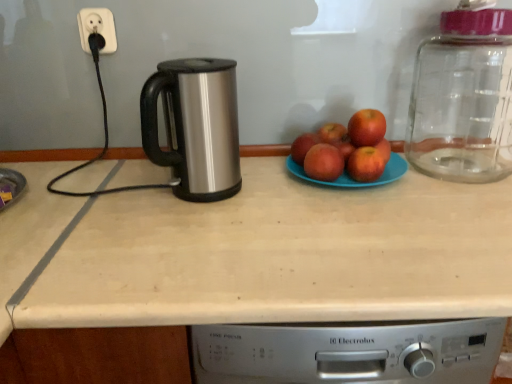
Based on the photo, measure the distance between point [110,37] and camera.

Point [110,37] is 37.99 inches away from camera.

Image resolution: width=512 pixels, height=384 pixels. Find the location of `white plastic socket at upper left`. white plastic socket at upper left is located at coordinates (97, 28).

What do you see at coordinates (366, 164) in the screenshot? The width and height of the screenshot is (512, 384). I see `red matte apple at center, the 4th apple from the back` at bounding box center [366, 164].

You are a GUI agent. You are given a task and a screenshot of the screen. Output one action in this format:
    pyautogui.click(x=<x>, y=<y>)
    Task: Click on the white plastic socket at upper left
    
    Given the screenshot: What is the action you would take?
    pyautogui.click(x=97, y=28)

Which object is further away from the camera, red matte apple at center, placed as the fourth apple when sorted from front to back, or red matte apple at center, the 4th apple from the back?

Positioned behind is red matte apple at center, placed as the fourth apple when sorted from front to back.

Looking at this image, is red matte apple at center, the 2th apple in the back-to-front sequence, positioned with its back to red matte apple at center, the 4th apple from the back?

No, red matte apple at center, the 2th apple in the back-to-front sequence, is not facing away from red matte apple at center, the 4th apple from the back.

Which is more to the right, red matte apple at center, the 2th apple in the back-to-front sequence, or red matte apple at center, the 4th apple from the back?

Positioned to the right is red matte apple at center, the 4th apple from the back.

Is red matte apple at center, the 2th apple in the back-to-front sequence, next to red matte apple at center, the 4th apple from the back, and touching it?

There is a gap between red matte apple at center, the 2th apple in the back-to-front sequence, and red matte apple at center, the 4th apple from the back.

Identify the location of apple that is the 1st object located below the polished stainless steel kettle at center (from the image's perspective). (303, 146).

Would you consider red matte apple at center, placed as the fourth apple when sorted from front to back, to be distant from polished stainless steel kettle at center?

red matte apple at center, placed as the fourth apple when sorted from front to back, is near polished stainless steel kettle at center, not far away.

Would you say red matte apple at center, placed as the fourth apple when sorted from front to back, is outside polished stainless steel kettle at center?

Yes, red matte apple at center, placed as the fourth apple when sorted from front to back, is not within polished stainless steel kettle at center.

Is beige laminate countertop at center inside the boundaries of red matte apple at center, placed as the fourth apple when sorted from front to back, or outside?

beige laminate countertop at center is located beyond the bounds of red matte apple at center, placed as the fourth apple when sorted from front to back.

Is beige laminate countertop at center positioned with its back to red matte apple at center, placed as the fourth apple when sorted from front to back?

beige laminate countertop at center does not have its back to red matte apple at center, placed as the fourth apple when sorted from front to back.

Between beige laminate countertop at center and red matte apple at center, placed as the fourth apple when sorted from front to back, which one has smaller size?

red matte apple at center, placed as the fourth apple when sorted from front to back.

From a real-world perspective, between beige laminate countertop at center and red matte apple at center, the 2th apple in the back-to-front sequence, who is vertically lower?

A: In real-world perspective, beige laminate countertop at center is lower.

Is point (15, 307) closer to viewer compared to point (297, 171)?

Yes, it is in front of point (297, 171).

From their relative heights in the image, would you say beige laminate countertop at center is taller or shorter than blue matte plate at center?

Clearly, beige laminate countertop at center is taller compared to blue matte plate at center.

Considering the positions of objects beige laminate countertop at center and blue matte plate at center in the image provided, who is behind, beige laminate countertop at center or blue matte plate at center?

blue matte plate at center is further from the camera.

Is beige laminate countertop at center positioned far away from blue matte plate at center?

No.

Considering the relative sizes of polished stainless steel kettle at center and red matte apple at center, placed as the 3th apple when sorted from back to front, in the image provided, is polished stainless steel kettle at center taller than red matte apple at center, placed as the 3th apple when sorted from back to front,?

Indeed, polished stainless steel kettle at center has a greater height compared to red matte apple at center, placed as the 3th apple when sorted from back to front.

Does polished stainless steel kettle at center turn towards red matte apple at center, which is the third apple from front to back?

No, polished stainless steel kettle at center is not facing towards red matte apple at center, which is the third apple from front to back.

Is polished stainless steel kettle at center in contact with red matte apple at center, which is the third apple from front to back?

No, polished stainless steel kettle at center is not touching red matte apple at center, which is the third apple from front to back.

You are a GUI agent. You are given a task and a screenshot of the screen. Output one action in this format:
    pyautogui.click(x=<x>, y=<y>)
    Task: Click on the kitchen appliance that appears on the left of red matte apple at center, placed as the 3th apple when sorted from back to front
    
    Given the screenshot: What is the action you would take?
    pyautogui.click(x=195, y=126)

From the picture: Is polished stainless steel kettle at center not close to red matte apple at center, the 2th apple in the back-to-front sequence?

Actually, polished stainless steel kettle at center and red matte apple at center, the 2th apple in the back-to-front sequence, are a little close together.

Is polished stainless steel kettle at center not within red matte apple at center, placed as the fourth apple when sorted from front to back?

Yes, polished stainless steel kettle at center is not within red matte apple at center, placed as the fourth apple when sorted from front to back.

From the picture: From a real-world perspective, which object stands above the other?

polished stainless steel kettle at center is physically above.

How many degrees apart are the facing directions of polished stainless steel kettle at center and red matte apple at center, placed as the fourth apple when sorted from front to back?

The angular difference between polished stainless steel kettle at center and red matte apple at center, placed as the fourth apple when sorted from front to back, is 39.4 degrees.

Is beige laminate countertop at center positioned far away from transparent glass jar at right?

No, there isn't a large distance between beige laminate countertop at center and transparent glass jar at right.

Based on the photo, from the image's perspective, does beige laminate countertop at center appear higher than transparent glass jar at right?

No.

How different are the orientations of beige laminate countertop at center and transparent glass jar at right in degrees?

There is a 0.564-degree angle between the facing directions of beige laminate countertop at center and transparent glass jar at right.

Looking at this image, can you confirm if beige laminate countertop at center is smaller than transparent glass jar at right?

No.

Starting from the red matte apple at center, placed as the 2th apple when sorted from front to back, which apple is the 3rd one to the left? Please provide its 2D coordinates.

[(303, 146)]

You are a GUI agent. You are given a task and a screenshot of the screen. Output one action in this format:
    pyautogui.click(x=<x>, y=<y>)
    Task: Click on the kitchen appliance that is in front of the red matte apple at center, placed as the fourth apple when sorted from front to back
    
    Given the screenshot: What is the action you would take?
    point(195,126)

From the image, which object appears to be nearer to red matte apple at center, the 1th apple positioned from the back, red matte apple at center, the 2th apple in the back-to-front sequence, or red matte apple at center, acting as the 5th apple starting from the back?

The object closer to red matte apple at center, the 1th apple positioned from the back, is red matte apple at center, the 2th apple in the back-to-front sequence.

Considering their positions, is transparent glass jar at right positioned further to blue matte plate at center than red matte apple at center, the 4th apple from the back?

Based on the image, transparent glass jar at right appears to be further to blue matte plate at center.

When comparing their distances from beige laminate countertop at center, does red matte apple at center, which is the third apple from front to back, or red matte apple at center, the 2th apple in the back-to-front sequence, seem further?

red matte apple at center, which is the third apple from front to back, is further to beige laminate countertop at center.

Considering their positions, is polished stainless steel kettle at center positioned closer to red matte apple at center, which is counted as the 5th apple, starting from the front, than blue matte plate at center?

The object closer to red matte apple at center, which is counted as the 5th apple, starting from the front, is blue matte plate at center.

In the scene shown: Which object lies further to the anchor point red matte apple at center, which is counted as the 5th apple, starting from the front, red matte apple at center, placed as the 3th apple when sorted from back to front, or white plastic socket at upper left?

Among the two, white plastic socket at upper left is located further to red matte apple at center, which is counted as the 5th apple, starting from the front.

In the scene shown: Estimate the real-world distances between objects in this image. Which object is further from white plastic socket at upper left, red matte apple at center, the 1th apple positioned from the back, or red matte apple at center, which is counted as the 1th apple, starting from the front?

red matte apple at center, the 1th apple positioned from the back.

Which object lies further to the anchor point red matte apple at center, placed as the 2th apple when sorted from front to back, polished stainless steel kettle at center or red matte apple at center, placed as the fourth apple when sorted from front to back?

polished stainless steel kettle at center is positioned further to the anchor red matte apple at center, placed as the 2th apple when sorted from front to back.

Estimate the real-world distances between objects in this image. Which object is further from red matte apple at center, which is counted as the 1th apple, starting from the front, blue matte plate at center or white plastic socket at upper left?

Based on the image, white plastic socket at upper left appears to be further to red matte apple at center, which is counted as the 1th apple, starting from the front.

At what (x,y) coordinates should I click in order to perform the action: click on apple that lies between red matte apple at center, which is counted as the 1th apple, starting from the front, and beige laminate countertop at center from top to bottom. Please return your answer as a coordinate pair (x, y). Looking at the image, I should click on (366, 164).

You are a GUI agent. You are given a task and a screenshot of the screen. Output one action in this format:
    pyautogui.click(x=<x>, y=<y>)
    Task: Click on the paper plate located between white plastic socket at upper left and red matte apple at center, placed as the 3th apple when sorted from back to front, in the left-right direction
    The width and height of the screenshot is (512, 384).
    Given the screenshot: What is the action you would take?
    pyautogui.click(x=353, y=179)

This screenshot has height=384, width=512. Identify the location of apple located between red matte apple at center, placed as the 2th apple when sorted from front to back, and transparent glass jar at right in the left-right direction. (366, 128).

Image resolution: width=512 pixels, height=384 pixels. What are the coordinates of `paper plate between red matte apple at center, placed as the fourth apple when sorted from front to back, and red matte apple at center, which is the third apple from front to back` in the screenshot? It's located at (353, 179).